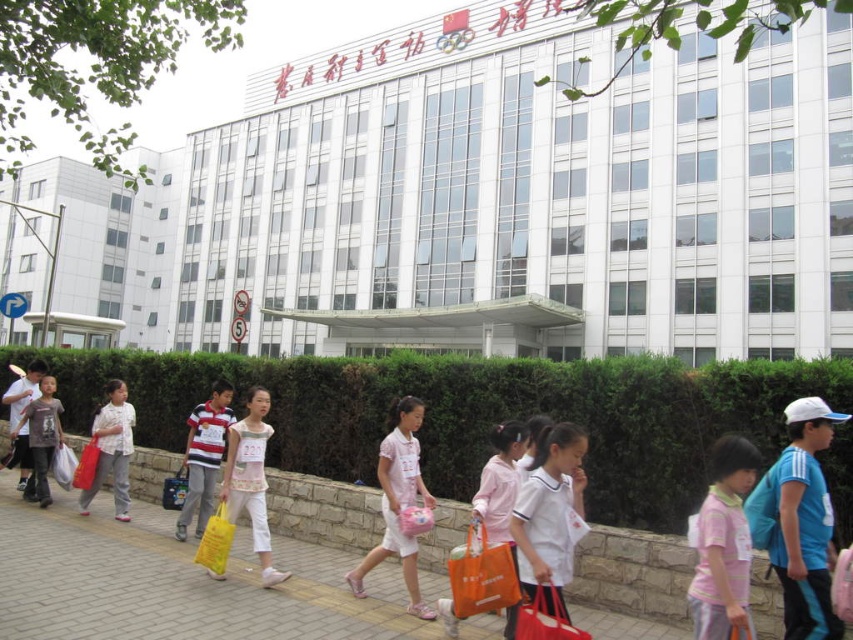
You are a photographer trying to capture both the light pink fabric dress at center and the striped cotton shirt at center in a single shot. Since the camera can only focus on one subject at a time, which clothing item should you choose to ensure it fills the frame better?

The light pink fabric dress at center is larger in size than the striped cotton shirt at center, so you should focus on the light pink fabric dress at center to ensure it fills the frame better.

Consider the image. You are a photographer standing at the end of the pathway. You want to take a photo of the brick pavement at center and the matte gray shirt at left. Which object should you focus on first to ensure both are in the frame?

The brick pavement at center is in front of matte gray shirt at left, so you should focus on the matte gray shirt at left first to ensure both are in the frame.